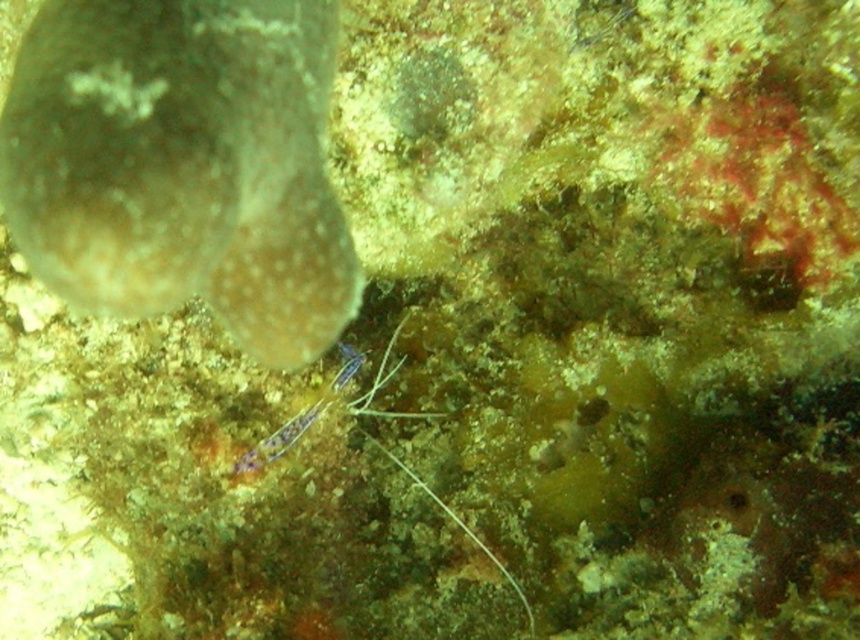
Which is below, brown speckled shell at upper left or purple iridescent shrimp at center?

purple iridescent shrimp at center is lower down.

Is brown speckled shell at upper left below purple iridescent shrimp at center?

Actually, brown speckled shell at upper left is above purple iridescent shrimp at center.

You are a GUI agent. You are given a task and a screenshot of the screen. Output one action in this format:
    pyautogui.click(x=<x>, y=<y>)
    Task: Click on the brown speckled shell at upper left
    
    Given the screenshot: What is the action you would take?
    pyautogui.click(x=182, y=164)